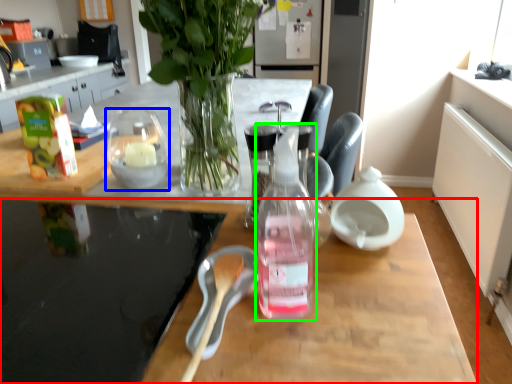
Question: Estimate the real-world distances between objects in this image. Which object is farther from desk (highlighted by a red box), tableware (highlighted by a blue box) or bottle (highlighted by a green box)?

Choices:
 (A) tableware
 (B) bottle

Answer: (A)